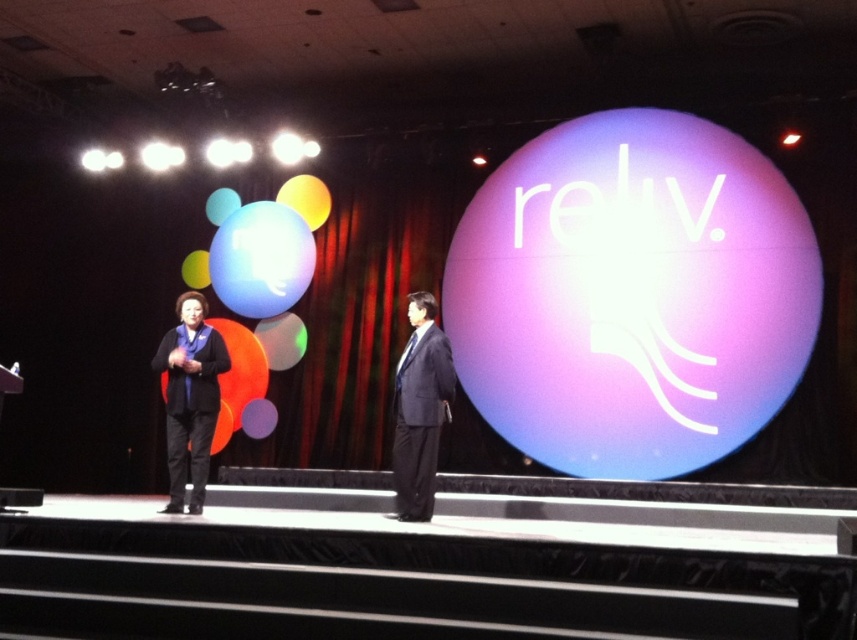
Question: Is black matte business suit at left bigger than black matte business suit at center?

Choices:
 (A) no
 (B) yes

Answer: (B)

Question: Which object appears farthest from the camera in this image?

Choices:
 (A) black matte business suit at left
 (B) black matte business suit at center

Answer: (A)

Question: Which of the following is the farthest from the observer?

Choices:
 (A) black matte business suit at center
 (B) black matte business suit at left

Answer: (B)

Question: Can you confirm if black matte business suit at left is thinner than black matte business suit at center?

Choices:
 (A) no
 (B) yes

Answer: (A)

Question: Can you confirm if black matte business suit at left is thinner than black matte business suit at center?

Choices:
 (A) yes
 (B) no

Answer: (B)